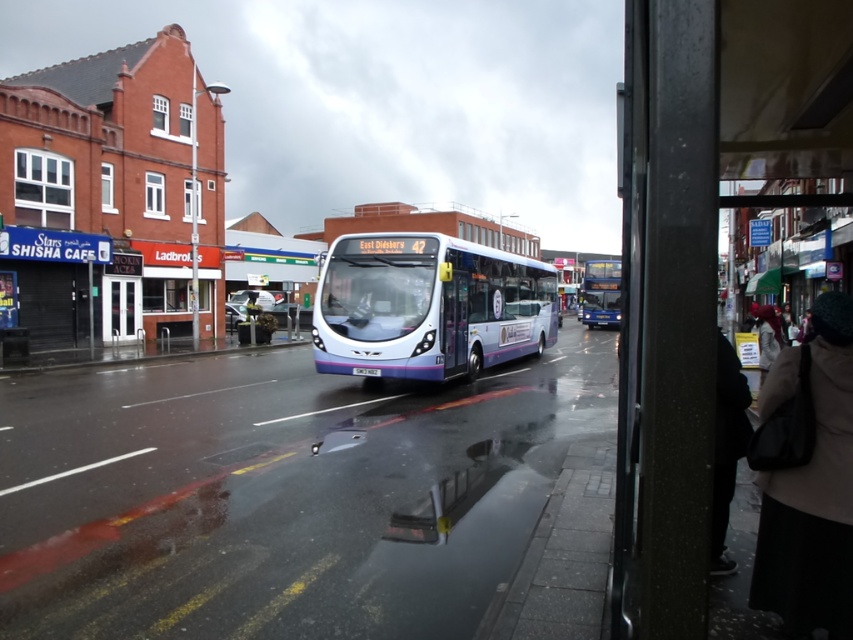
Who is lower down, white glossy bus at center or beige wool coat at lower right?

beige wool coat at lower right

Does white glossy bus at center have a smaller size compared to beige wool coat at lower right?

Actually, white glossy bus at center might be larger than beige wool coat at lower right.

Image resolution: width=853 pixels, height=640 pixels. I want to click on white glossy bus at center, so click(428, 307).

The image size is (853, 640). Find the location of `white glossy bus at center`. white glossy bus at center is located at coordinates (428, 307).

Which is above, beige wool coat at lower right or dark gray fabric jacket at lower right?

beige wool coat at lower right is above.

Who is taller, beige wool coat at lower right or dark gray fabric jacket at lower right?

beige wool coat at lower right

Who is more forward, (817,332) or (738,435)?

Point (817,332) is in front.

The image size is (853, 640). In order to click on beige wool coat at lower right in this screenshot , I will do `click(807, 477)`.

The image size is (853, 640). What do you see at coordinates (428, 307) in the screenshot?
I see `white glossy bus at center` at bounding box center [428, 307].

How much distance is there between white glossy bus at center and dark gray fabric jacket at lower right?

white glossy bus at center and dark gray fabric jacket at lower right are 37.76 feet apart from each other.

Image resolution: width=853 pixels, height=640 pixels. What do you see at coordinates (428, 307) in the screenshot? I see `white glossy bus at center` at bounding box center [428, 307].

Where is `white glossy bus at center`? The width and height of the screenshot is (853, 640). white glossy bus at center is located at coordinates (428, 307).